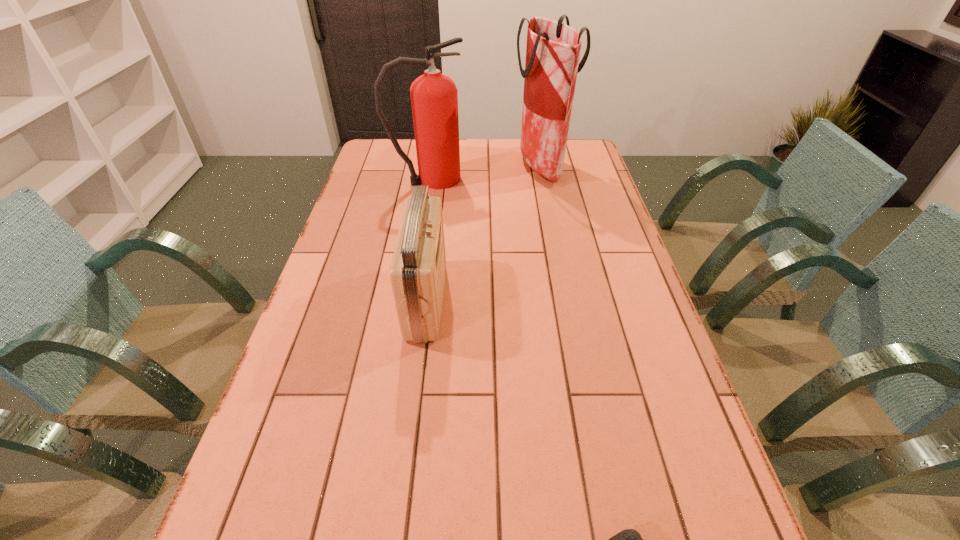
Locate an element on the screen. object situated at the right edge is located at coordinates (553, 49).

The image size is (960, 540). I want to click on object that is at the far left corner, so click(x=434, y=97).

Find the location of a particular element. This screenshot has height=540, width=960. object that is positioned at the far right corner is located at coordinates (553, 49).

Where is `free location at the left edge of the desktop`? free location at the left edge of the desktop is located at coordinates (352, 256).

The width and height of the screenshot is (960, 540). In order to click on free space at the right edge of the desktop in this screenshot , I will do `click(657, 317)`.

Find the location of a particular element. free space at the far left corner of the desktop is located at coordinates (384, 147).

I want to click on free spot between the grocery bag and the fire extinguisher, so click(485, 173).

Where is `vacant area between the fire extinguisher and the grocery bag`? vacant area between the fire extinguisher and the grocery bag is located at coordinates (485, 173).

Locate an element on the screen. The height and width of the screenshot is (540, 960). vacant region between the grocery bag and the fire extinguisher is located at coordinates (485, 173).

Find the location of a particular element. Image resolution: width=960 pixels, height=540 pixels. free space between the grocery bag and the fire extinguisher is located at coordinates (485, 173).